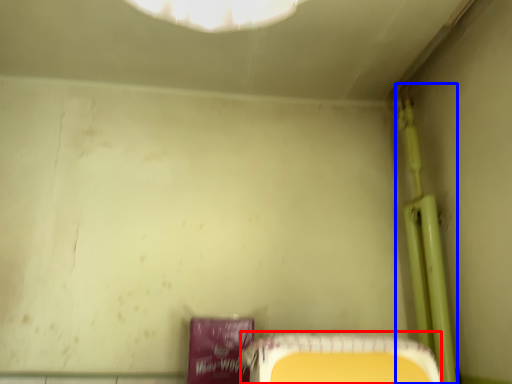
Question: Which point is further to the camera, furniture (highlighted by a red box) or pipe (highlighted by a blue box)?

Choices:
 (A) furniture
 (B) pipe

Answer: (B)